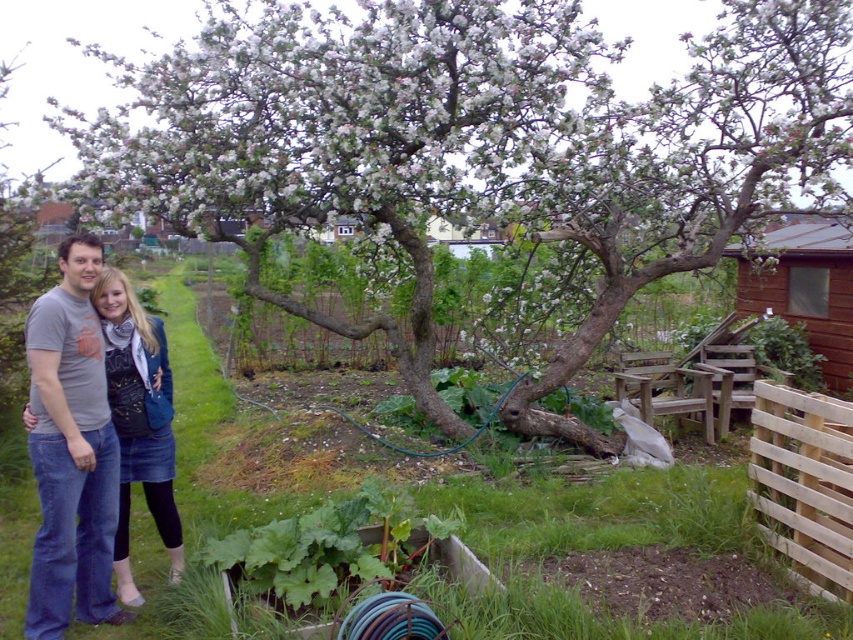
Question: Which object is positioned farthest from the smooth bark tree at center?

Choices:
 (A) denim jacket at lower left
 (B) light brown wooden fence at lower right

Answer: (A)

Question: Which object is the farthest from the smooth bark tree at center?

Choices:
 (A) light brown wooden fence at lower right
 (B) denim jacket at lower left

Answer: (B)

Question: Can you confirm if smooth bark tree at center is positioned to the right of denim jacket at lower left?

Choices:
 (A) no
 (B) yes

Answer: (B)

Question: Is denim jacket at lower left positioned before light brown wooden fence at lower right?

Choices:
 (A) no
 (B) yes

Answer: (B)

Question: Can you confirm if smooth bark tree at center is positioned below denim jacket at lower left?

Choices:
 (A) no
 (B) yes

Answer: (A)

Question: Which of the following is the farthest from the observer?

Choices:
 (A) light brown wooden fence at lower right
 (B) smooth bark tree at center

Answer: (B)